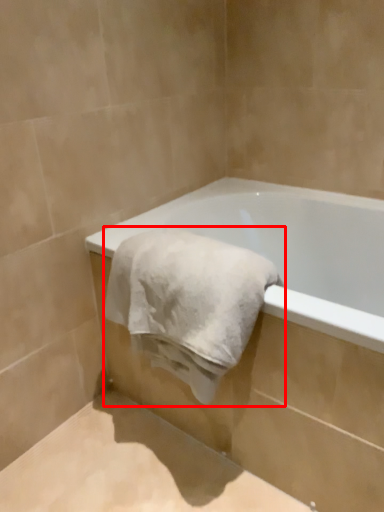
Question: Observing the image, what is the correct spatial positioning of towel (annotated by the red box) in reference to bathtub?

Choices:
 (A) left
 (B) right

Answer: (A)